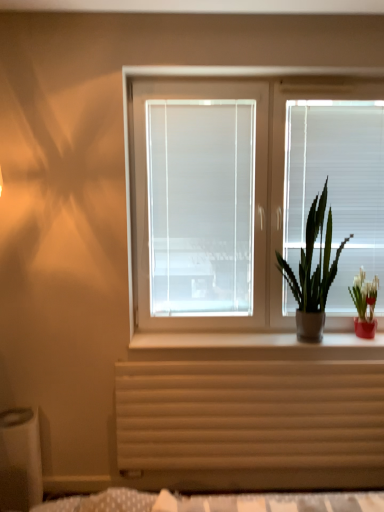
Question: Is white matte window box at lower left at the right side of white matte window sill at center?

Choices:
 (A) no
 (B) yes

Answer: (A)

Question: Is white matte window box at lower left facing towards white matte window sill at center?

Choices:
 (A) no
 (B) yes

Answer: (B)

Question: Is white matte window box at lower left positioned far away from white matte window sill at center?

Choices:
 (A) no
 (B) yes

Answer: (A)

Question: Is white matte window box at lower left positioned before white matte window sill at center?

Choices:
 (A) no
 (B) yes

Answer: (B)

Question: Does white matte window box at lower left have a lesser width compared to white matte window sill at center?

Choices:
 (A) yes
 (B) no

Answer: (B)

Question: Can you confirm if white matte window box at lower left is taller than white matte window sill at center?

Choices:
 (A) yes
 (B) no

Answer: (A)

Question: From a real-world perspective, is green leafy plant at right, arranged as the 1th houseplant when viewed from the right, over wooden radiator at lower center?

Choices:
 (A) no
 (B) yes

Answer: (B)

Question: From a real-world perspective, does green leafy plant at right, arranged as the 1th houseplant when viewed from the right, sit lower than wooden radiator at lower center?

Choices:
 (A) yes
 (B) no

Answer: (B)

Question: From the image's perspective, does green leafy plant at right, marked as the 2th houseplant in a left-to-right arrangement, appear higher than wooden radiator at lower center?

Choices:
 (A) yes
 (B) no

Answer: (A)

Question: Is green leafy plant at right, arranged as the 1th houseplant when viewed from the right, bigger than wooden radiator at lower center?

Choices:
 (A) yes
 (B) no

Answer: (B)

Question: Does green leafy plant at right, marked as the 2th houseplant in a left-to-right arrangement, have a smaller size compared to wooden radiator at lower center?

Choices:
 (A) no
 (B) yes

Answer: (B)

Question: Does green leafy plant at right, marked as the 2th houseplant in a left-to-right arrangement, appear on the right side of wooden radiator at lower center?

Choices:
 (A) no
 (B) yes

Answer: (B)

Question: Could white matte window box at lower left be considered to be inside white matte blind at right?

Choices:
 (A) no
 (B) yes

Answer: (A)